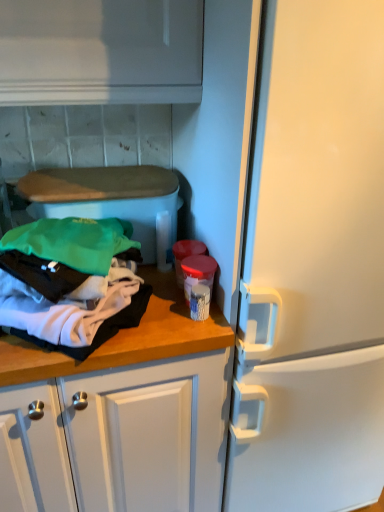
Question: Considering the relative sizes of soft cotton clothes at left and wooden at left in the image provided, is soft cotton clothes at left smaller than wooden at left?

Choices:
 (A) no
 (B) yes

Answer: (A)

Question: From a real-world perspective, is soft cotton clothes at left beneath wooden at left?

Choices:
 (A) no
 (B) yes

Answer: (A)

Question: Is soft cotton clothes at left at the left side of wooden at left?

Choices:
 (A) yes
 (B) no

Answer: (A)

Question: From the image's perspective, does soft cotton clothes at left appear lower than wooden at left?

Choices:
 (A) yes
 (B) no

Answer: (B)

Question: Is soft cotton clothes at left shorter than wooden at left?

Choices:
 (A) yes
 (B) no

Answer: (B)

Question: Is soft cotton clothes at left far away from wooden at left?

Choices:
 (A) no
 (B) yes

Answer: (A)

Question: From a real-world perspective, is wooden at left positioned under soft cotton clothes at left based on gravity?

Choices:
 (A) no
 (B) yes

Answer: (B)

Question: From the image's perspective, does wooden at left appear lower than soft cotton clothes at left?

Choices:
 (A) yes
 (B) no

Answer: (A)

Question: Is wooden at left outside soft cotton clothes at left?

Choices:
 (A) yes
 (B) no

Answer: (A)

Question: Is soft cotton clothes at left at the back of wooden at left?

Choices:
 (A) no
 (B) yes

Answer: (A)

Question: From a real-world perspective, is wooden at left over soft cotton clothes at left?

Choices:
 (A) yes
 (B) no

Answer: (B)

Question: Is wooden at left closer to the viewer compared to soft cotton clothes at left?

Choices:
 (A) yes
 (B) no

Answer: (B)

Question: From the image's perspective, is soft cotton clothes at left above or below wooden at left?

Choices:
 (A) below
 (B) above

Answer: (B)